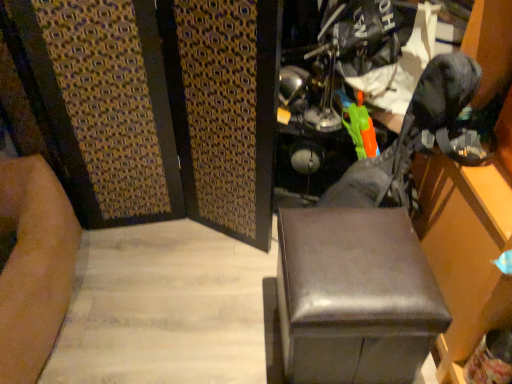
Question: Should I look upward or downward to see shiny brown ottoman at center?

Choices:
 (A) up
 (B) down

Answer: (B)

Question: Can you confirm if shiny brown ottoman at center is bigger than leather swivel chair at center?

Choices:
 (A) no
 (B) yes

Answer: (A)

Question: From the image's perspective, does shiny brown ottoman at center appear lower than leather swivel chair at center?

Choices:
 (A) yes
 (B) no

Answer: (A)

Question: Is shiny brown ottoman at center not near leather swivel chair at center?

Choices:
 (A) no
 (B) yes

Answer: (A)

Question: Is shiny brown ottoman at center wider than leather swivel chair at center?

Choices:
 (A) no
 (B) yes

Answer: (B)

Question: From the image's perspective, is shiny brown ottoman at center on top of leather swivel chair at center?

Choices:
 (A) no
 (B) yes

Answer: (A)

Question: Does shiny brown ottoman at center contain leather swivel chair at center?

Choices:
 (A) no
 (B) yes

Answer: (A)

Question: Is leather swivel chair at center taller than shiny brown ottoman at center?

Choices:
 (A) yes
 (B) no

Answer: (A)

Question: Is leather swivel chair at center behind shiny brown ottoman at center?

Choices:
 (A) yes
 (B) no

Answer: (B)

Question: Is leather swivel chair at center shorter than shiny brown ottoman at center?

Choices:
 (A) yes
 (B) no

Answer: (B)

Question: From a real-world perspective, is leather swivel chair at center on top of shiny brown ottoman at center?

Choices:
 (A) yes
 (B) no

Answer: (A)

Question: Is leather swivel chair at center closer to the viewer compared to shiny brown ottoman at center?

Choices:
 (A) yes
 (B) no

Answer: (A)

Question: Would you say leather swivel chair at center is outside shiny brown ottoman at center?

Choices:
 (A) yes
 (B) no

Answer: (A)

Question: From a real-world perspective, is leather swivel chair at center above or below shiny brown ottoman at center?

Choices:
 (A) above
 (B) below

Answer: (A)